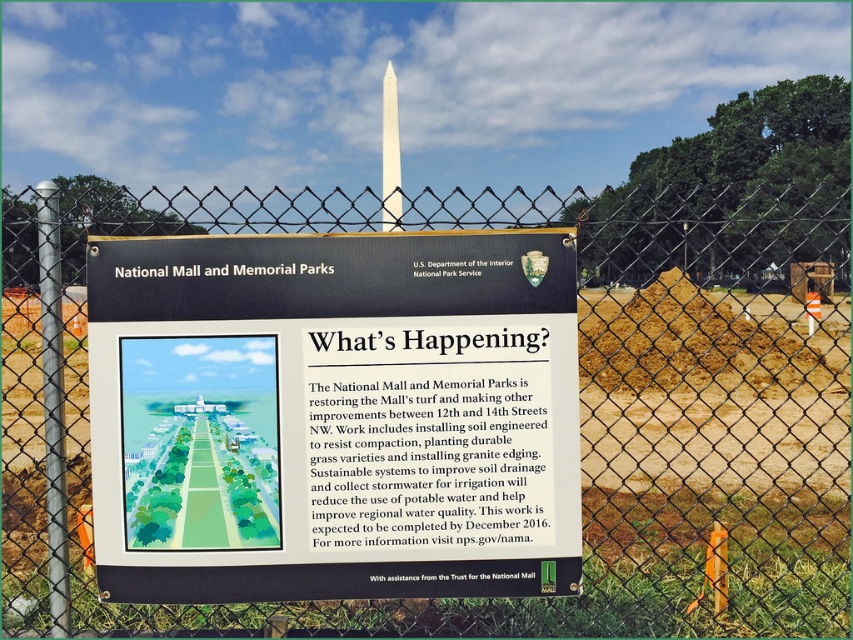
Who is higher up, metal chain-link fence at center or white paper sign at center?

metal chain-link fence at center is higher up.

Who is shorter, metal chain-link fence at center or white paper sign at center?

white paper sign at center is shorter.

Which is behind, point (833, 225) or point (113, 294)?

Point (833, 225)

This screenshot has width=853, height=640. I want to click on metal chain-link fence at center, so click(x=579, y=397).